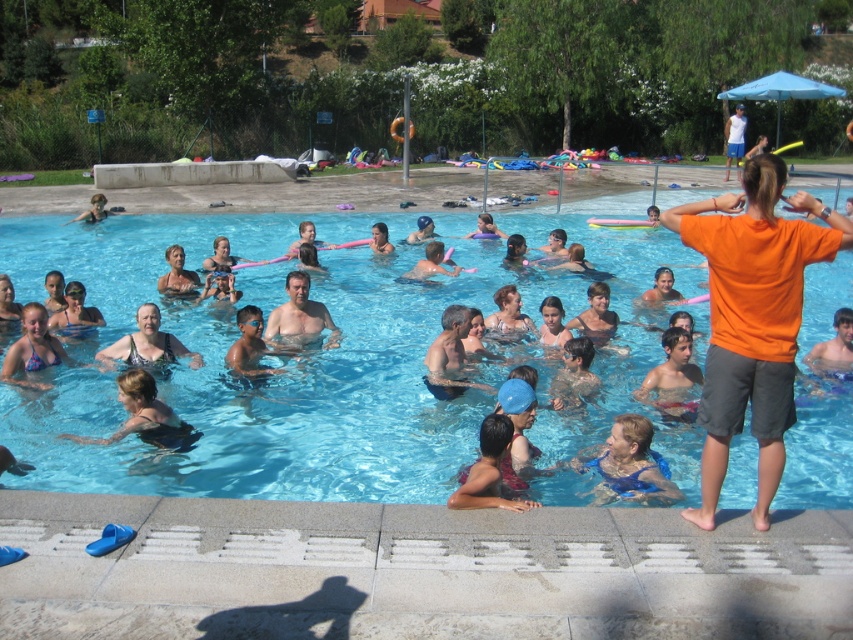
You are a photographer positioned at the edge of the pool. You need to capture a photo of both the smooth skin man at center and the matte black swimsuit at center. Which subject appears narrower in the photo?

The smooth skin man at center appears narrower in the photo because his width is less than that of the matte black swimsuit at center.

You are standing at the edge of the pool and want to walk to the point marked as point (154,352). However, there is an obstacle at point (300,285). Will you be able to reach your destination without going around the obstacle?

Since point (300,285) is further to the camera than point (154,352), the obstacle at point (300,285) is behind the destination point (154,352). Therefore, you can reach point (154,352) directly without needing to go around the obstacle.

Looking at this image, you are standing on the deck and want to reach the orange cotton shirt at right without stepping into the transparent blue water at center. Is this possible?

The transparent blue water at center is further to the viewer than orange cotton shirt at right, so the orange cotton shirt at right is closer to you on the deck. Therefore, you can reach it without stepping into the water.